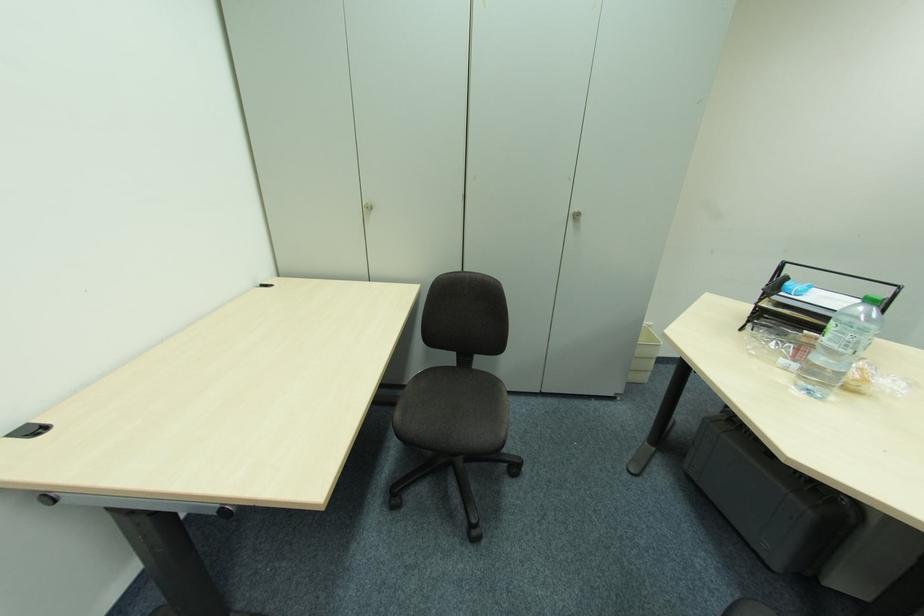
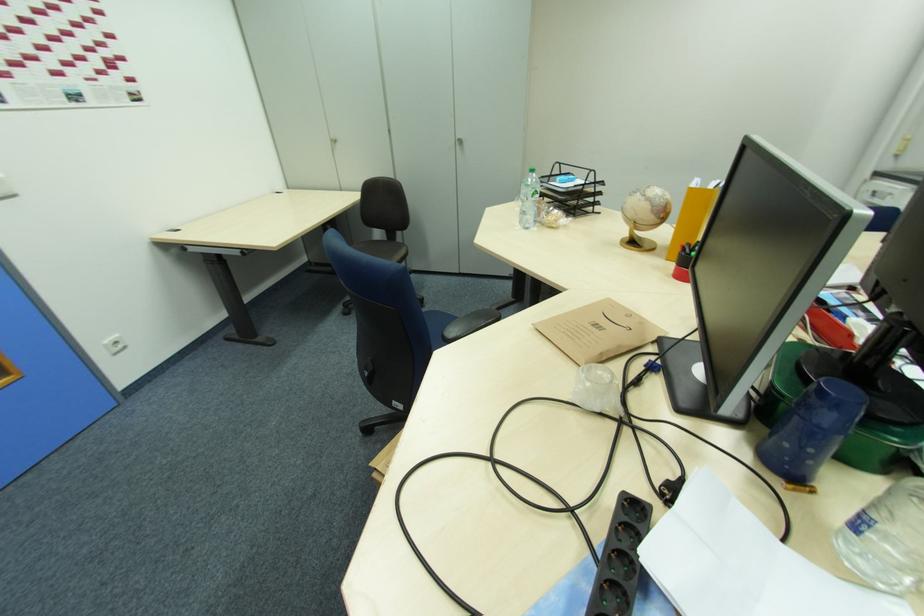
The images are taken continuously from a first-person perspective. In which direction are you moving?

The cameraman walked toward right, backward.